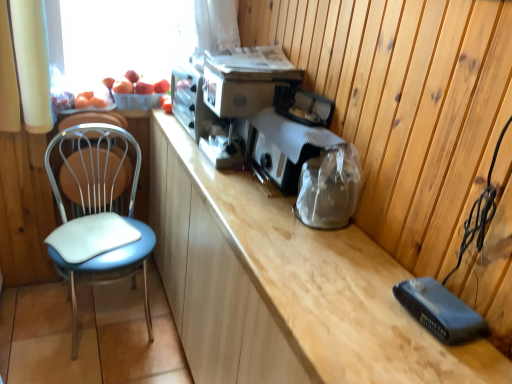
Describe the element at coordinates (290, 135) in the screenshot. This screenshot has height=384, width=512. I see `matte black toaster at center, which is counted as the first appliance, starting from the front` at that location.

What do you see at coordinates (286, 286) in the screenshot? The height and width of the screenshot is (384, 512). I see `wooden cabinet at center` at bounding box center [286, 286].

Image resolution: width=512 pixels, height=384 pixels. I want to click on wooden cabinet at center, so click(x=286, y=286).

Describe the element at coordinates (125, 37) in the screenshot. Image resolution: width=512 pixels, height=384 pixels. I see `translucent plastic basket at upper left` at that location.

At what (x,y) coordinates should I click in order to perform the action: click on translucent plastic basket at upper left. Please return your answer as a coordinate pair (x, y). The height and width of the screenshot is (384, 512). Looking at the image, I should click on (125, 37).

This screenshot has width=512, height=384. Describe the element at coordinates (93, 119) in the screenshot. I see `white leather swivel chair at left` at that location.

The width and height of the screenshot is (512, 384). Find the location of `matte black toaster at center, which is counted as the first appliance, starting from the front`. matte black toaster at center, which is counted as the first appliance, starting from the front is located at coordinates (290, 135).

Consider the image. Is metallic silver toaster at center, which is counted as the first appliance, starting from the back, beside wooden cabinet at center?

No, metallic silver toaster at center, which is counted as the first appliance, starting from the back, is not next to wooden cabinet at center.

Does metallic silver toaster at center, the second appliance positioned from the front, turn towards wooden cabinet at center?

No, metallic silver toaster at center, the second appliance positioned from the front, is not turned towards wooden cabinet at center.

Consider the image. Does metallic silver toaster at center, the second appliance positioned from the front, appear on the right side of wooden cabinet at center?

Correct, you'll find metallic silver toaster at center, the second appliance positioned from the front, to the right of wooden cabinet at center.

What's the angular difference between wooden cabinet at center and blue leatherette chair at left's facing directions?

There is a 90.6-degree angle between the facing directions of wooden cabinet at center and blue leatherette chair at left.

Is wooden cabinet at center in front of or behind blue leatherette chair at left in the image?

wooden cabinet at center is positioned closer to the viewer than blue leatherette chair at left.

Which is farther, (229, 344) or (114, 257)?

The point (114, 257) is farther from the camera.

From a real-world perspective, which object stands above the other?

wooden cabinet at center is physically above.

Between white leather swivel chair at left and blue leatherette chair at left, which one appears on the left side from the viewer's perspective?

white leather swivel chair at left.

Does white leather swivel chair at left have a larger size compared to blue leatherette chair at left?

Actually, white leather swivel chair at left might be smaller than blue leatherette chair at left.

Considering the positions of objects white leather swivel chair at left and blue leatherette chair at left in the image provided, who is behind, white leather swivel chair at left or blue leatherette chair at left?

white leather swivel chair at left is further away from the camera.

Is white leather swivel chair at left with blue leatherette chair at left?

No, white leather swivel chair at left is not beside blue leatherette chair at left.

Is white leather swivel chair at left bigger or smaller than translucent plastic basket at upper left?

Clearly, white leather swivel chair at left is smaller in size than translucent plastic basket at upper left.

Is point (75, 119) behind point (126, 5)?

That is False.

Is white leather swivel chair at left looking in the opposite direction of translucent plastic basket at upper left?

No, white leather swivel chair at left is not facing the opposite direction of translucent plastic basket at upper left.

Locate an element on the screen. swivel chair that appears behind the translucent plastic basket at upper left is located at coordinates (93, 119).

Is white leather swivel chair at left facing towards wooden cabinet at center?

No, white leather swivel chair at left is not aimed at wooden cabinet at center.

Is point (120, 122) closer or farther from the camera than point (218, 331)?

Point (120, 122) is positioned farther from the camera compared to point (218, 331).

From a real-world perspective, is white leather swivel chair at left positioned above or below wooden cabinet at center?

In terms of real-world spatial position, white leather swivel chair at left is below wooden cabinet at center.

Locate an element on the screen. This screenshot has height=384, width=512. swivel chair above the wooden cabinet at center (from the image's perspective) is located at coordinates (93, 119).

In the scene shown: Can you confirm if white leather swivel chair at left is taller than matte black toaster at center, which is counted as the first appliance, starting from the front?

Yes.

Which appliance is the 2nd one when counting from the front of the white leather swivel chair at left? Please provide its 2D coordinates.

[(290, 135)]

Would you say white leather swivel chair at left is a long distance from matte black toaster at center, the 2th appliance in the back-to-front sequence?

No, white leather swivel chair at left is not far from matte black toaster at center, the 2th appliance in the back-to-front sequence.

From a real-world perspective, is white leather swivel chair at left on top of matte black toaster at center, the 2th appliance in the back-to-front sequence?

No, from a real-world perspective, white leather swivel chair at left is not over matte black toaster at center, the 2th appliance in the back-to-front sequence

Considering the sizes of metallic silver toaster at center, which is counted as the first appliance, starting from the back, and translucent plastic basket at upper left in the image, is metallic silver toaster at center, which is counted as the first appliance, starting from the back, taller or shorter than translucent plastic basket at upper left?

Clearly, metallic silver toaster at center, which is counted as the first appliance, starting from the back, is shorter compared to translucent plastic basket at upper left.

Is metallic silver toaster at center, the second appliance positioned from the front, completely or partially outside of translucent plastic basket at upper left?

That's correct, metallic silver toaster at center, the second appliance positioned from the front, is outside of translucent plastic basket at upper left.

Looking at this image, which is closer to the camera, (x=262, y=93) or (x=77, y=81)?

Point (x=262, y=93) appears to be closer to the viewer than point (x=77, y=81).

Is metallic silver toaster at center, the second appliance positioned from the front, facing towards translucent plastic basket at upper left?

No, metallic silver toaster at center, the second appliance positioned from the front, is not facing towards translucent plastic basket at upper left.

Starting from the wooden cabinet at center, which appliance is the 2nd one behind? Please provide its 2D coordinates.

[(246, 83)]

The width and height of the screenshot is (512, 384). I want to click on chair above the wooden cabinet at center (from the image's perspective), so click(x=101, y=215).

When comparing their distances from translucent plastic basket at upper left, does metallic silver toaster at center, the second appliance positioned from the front, or wooden cabinet at center seem further?

The object further to translucent plastic basket at upper left is wooden cabinet at center.

Considering their positions, is wooden cabinet at center positioned further to white leather swivel chair at left than matte black toaster at center, the 2th appliance in the back-to-front sequence?

matte black toaster at center, the 2th appliance in the back-to-front sequence, is further to white leather swivel chair at left.

Which object lies further to the anchor point matte black toaster at center, which is counted as the first appliance, starting from the front, wooden cabinet at center or white leather swivel chair at left?

white leather swivel chair at left.

Which object lies further to the anchor point matte black toaster at center, the 2th appliance in the back-to-front sequence, metallic silver toaster at center, the second appliance positioned from the front, or translucent plastic basket at upper left?

Based on the image, translucent plastic basket at upper left appears to be further to matte black toaster at center, the 2th appliance in the back-to-front sequence.

Which object lies nearer to the anchor point translucent plastic basket at upper left, white leather swivel chair at left or metallic silver toaster at center, the second appliance positioned from the front?

Among the two, white leather swivel chair at left is located nearer to translucent plastic basket at upper left.

Which object lies further to the anchor point blue leatherette chair at left, translucent plastic basket at upper left or white leather swivel chair at left?

Based on the image, translucent plastic basket at upper left appears to be further to blue leatherette chair at left.

Based on their spatial positions, is translucent plastic basket at upper left or wooden cabinet at center further from blue leatherette chair at left?

wooden cabinet at center is further to blue leatherette chair at left.

Estimate the real-world distances between objects in this image. Which object is further from translucent plastic basket at upper left, matte black toaster at center, which is counted as the first appliance, starting from the front, or white leather swivel chair at left?

Based on the image, matte black toaster at center, which is counted as the first appliance, starting from the front, appears to be further to translucent plastic basket at upper left.

Locate an element on the screen. appliance located between translucent plastic basket at upper left and matte black toaster at center, which is counted as the first appliance, starting from the front, in the left-right direction is located at coordinates (246, 83).

Find the location of `cabinetry situated between blue leatherette chair at left and metallic silver toaster at center, the second appliance positioned from the front, from left to right`. cabinetry situated between blue leatherette chair at left and metallic silver toaster at center, the second appliance positioned from the front, from left to right is located at coordinates (286, 286).

Image resolution: width=512 pixels, height=384 pixels. What are the coordinates of `chair between wooden cabinet at center and white leather swivel chair at left from front to back` in the screenshot? It's located at (101, 215).

You are a GUI agent. You are given a task and a screenshot of the screen. Output one action in this format:
    pyautogui.click(x=<x>, y=<y>)
    Task: Click on the window screen between wooden cabinet at center and white leather swivel chair at left along the z-axis
    The width and height of the screenshot is (512, 384).
    Given the screenshot: What is the action you would take?
    pyautogui.click(x=125, y=37)